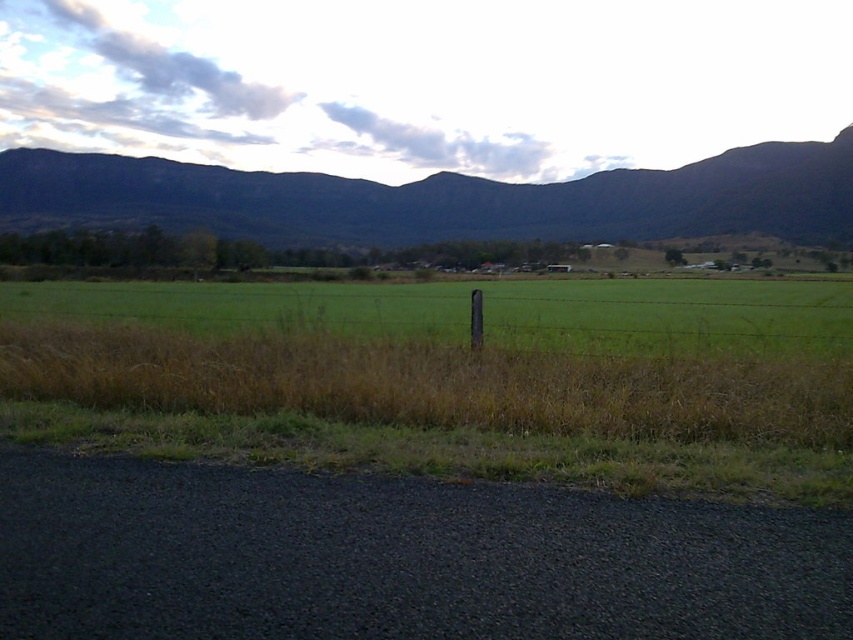
Question: Which object is farther from the camera taking this photo?

Choices:
 (A) dark green forested mountain at upper center
 (B) green grassy field at center
 (C) green grass at center

Answer: (A)

Question: Does green grass at center appear under green grassy field at center?

Choices:
 (A) no
 (B) yes

Answer: (B)

Question: Which point appears farthest from the camera in this image?

Choices:
 (A) (300, 291)
 (B) (744, 188)

Answer: (B)

Question: Is dark green forested mountain at upper center to the right of green grassy field at center from the viewer's perspective?

Choices:
 (A) yes
 (B) no

Answer: (B)

Question: Which of the following is the closest to the observer?

Choices:
 (A) (415, 294)
 (B) (202, 349)

Answer: (B)

Question: Considering the relative positions of green grass at center and dark green forested mountain at upper center in the image provided, where is green grass at center located with respect to dark green forested mountain at upper center?

Choices:
 (A) right
 (B) left

Answer: (B)